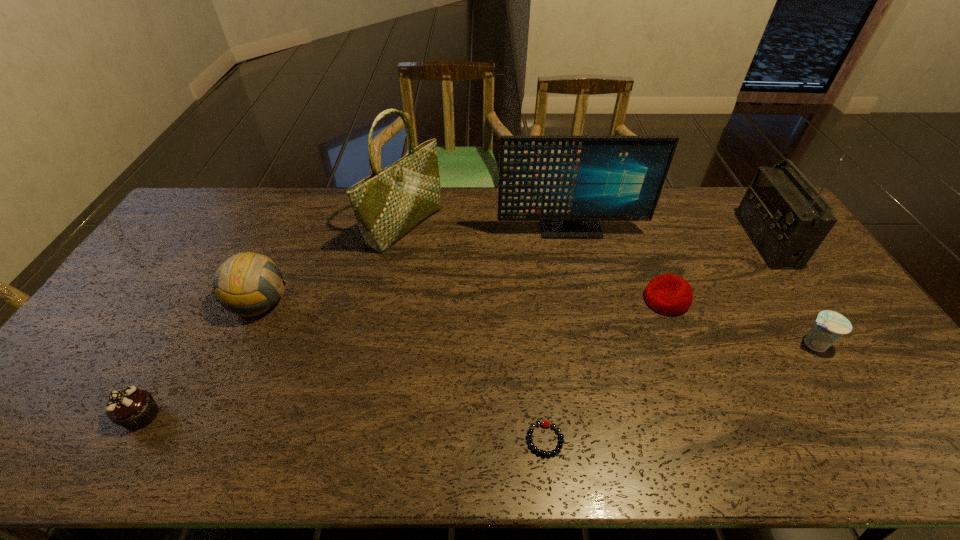
You are a GUI agent. You are given a task and a screenshot of the screen. Output one action in this format:
    pyautogui.click(x=<x>, y=<y>)
    Task: Click on the free space at the near edge of the desktop
    
    Given the screenshot: What is the action you would take?
    pyautogui.click(x=174, y=430)

I want to click on vacant region at the left edge, so click(x=82, y=368).

The image size is (960, 540). In the image, there is a desktop. Identify the location of blank space at the right edge. (869, 387).

This screenshot has width=960, height=540. I want to click on free region at the far left corner, so click(221, 217).

At what (x,y) coordinates should I click in order to perform the action: click on free space between the volleyball and the shortest object. Please return your answer as a coordinate pair (x, y). The height and width of the screenshot is (540, 960). Looking at the image, I should click on (402, 371).

The width and height of the screenshot is (960, 540). I want to click on free space between the beanbag and the shopping bag, so click(536, 263).

Where is `free space between the leftmost object and the shortest object`? The height and width of the screenshot is (540, 960). free space between the leftmost object and the shortest object is located at coordinates (344, 428).

Locate an element on the screen. The image size is (960, 540). free spot between the volleyball and the computer monitor is located at coordinates (415, 266).

At what (x,y) coordinates should I click in order to perform the action: click on empty location between the sixth farthest object and the shopping bag. Please return your answer as a coordinate pair (x, y). This screenshot has width=960, height=540. Looking at the image, I should click on (609, 285).

This screenshot has width=960, height=540. Find the location of `vacant area that lies between the beanbag and the sixth farthest object`. vacant area that lies between the beanbag and the sixth farthest object is located at coordinates (739, 322).